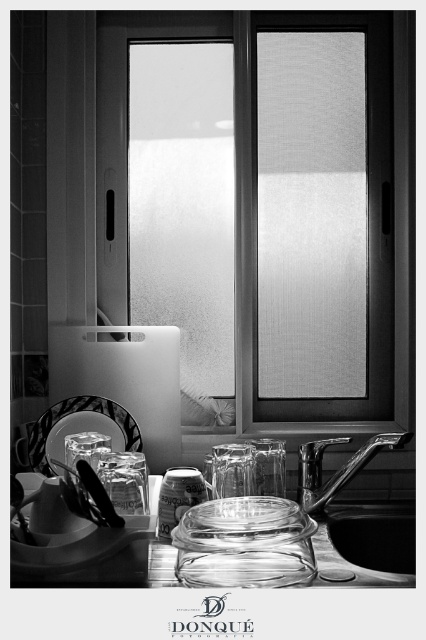
Consider the image. You are arranging items on the kitchen countertop and need to place both the metallic sink at lower right and the clear glass platter at lower center. Which object requires more horizontal space due to its greater width?

The metallic sink at lower right requires more horizontal space because its width surpasses that of the clear glass platter at lower center.

You are standing in the kitchen scene near the window. You notice two points marked in the image. Which point is closer to you, point 1 at coordinates point (103, 298) or point 2 at coordinates point (377, 438)?

Point 1 at coordinates point (103, 298) is closer to you because it is further to the viewer than point 2 at coordinates point (377, 438).